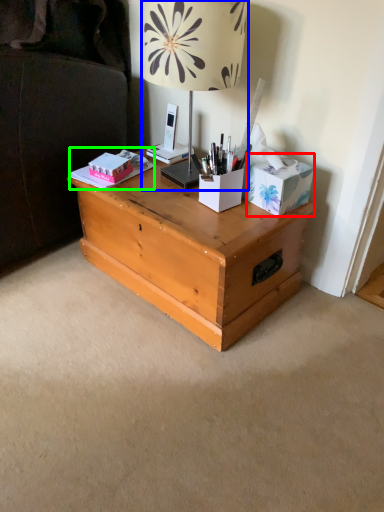
Question: Considering the real-world distances, which object is closest to cardboard box (highlighted by a red box)? lamp (highlighted by a blue box) or book (highlighted by a green box).

Choices:
 (A) lamp
 (B) book

Answer: (A)